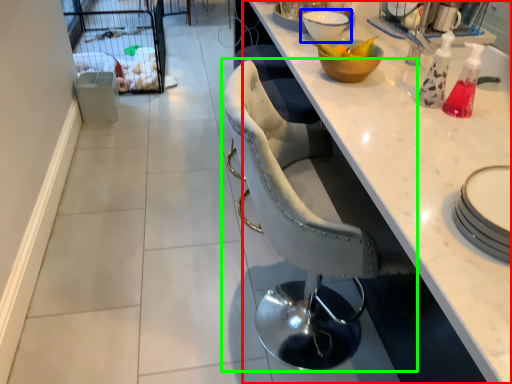
Question: Which is nearer to the countertop (highlighted by a red box)? bowl (highlighted by a blue box) or chair (highlighted by a green box).

Choices:
 (A) bowl
 (B) chair

Answer: (B)